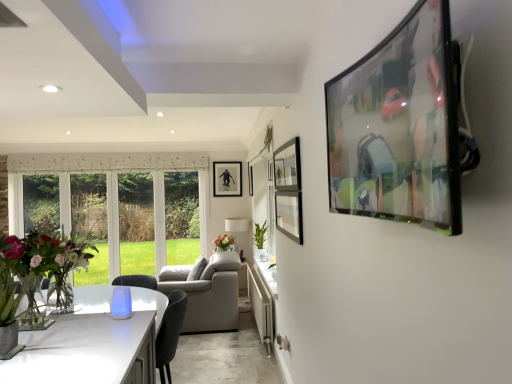
The image size is (512, 384). In order to click on matte black picture frame at center, the 2th picture frame positioned from the back in this screenshot , I will do `click(250, 179)`.

You are a GUI agent. You are given a task and a screenshot of the screen. Output one action in this format:
    pyautogui.click(x=<x>, y=<y>)
    Task: Click on the metallic silver picture frame at center, the 1th picture frame when ordered from back to front
    This screenshot has height=384, width=512.
    Given the screenshot: What is the action you would take?
    pos(227,179)

This screenshot has height=384, width=512. What are the coordinates of `white fabric lampshade at center` in the screenshot? It's located at (237, 224).

The height and width of the screenshot is (384, 512). I want to click on translucent glass vase at center, so click(x=224, y=241).

At what (x,y) coordinates should I click in order to perform the action: click on matte black picture frame at center, arranged as the second picture frame when viewed from the right. Please return your answer as a coordinate pair (x, y). This screenshot has width=512, height=384. Looking at the image, I should click on (250, 179).

Does point (248, 281) come farther from viewer compared to point (223, 239)?

No.

Is white glossy counter top at lower center aimed at translucent glass vase at center?

No, white glossy counter top at lower center is not facing towards translucent glass vase at center.

Where is `flower behind the white glossy counter top at lower center`? flower behind the white glossy counter top at lower center is located at coordinates (224, 241).

Considering the positions of objects white glossy counter top at lower center and translucent glass vase at center in the image provided, who is behind, white glossy counter top at lower center or translucent glass vase at center?

translucent glass vase at center is behind.

Does metallic silver picture frame at center, placed as the 3th picture frame when sorted from front to back, have a greater width compared to matte black picture frame at center, the 2th picture frame positioned from the back?

In fact, metallic silver picture frame at center, placed as the 3th picture frame when sorted from front to back, might be narrower than matte black picture frame at center, the 2th picture frame positioned from the back.

Is matte black picture frame at center, the 2th picture frame positioned from the back, at the back of metallic silver picture frame at center, arranged as the 1th picture frame when viewed from the left?

No.

Which of these two, metallic silver picture frame at center, acting as the third picture frame starting from the right, or matte black picture frame at center, the second picture frame when ordered from left to right, stands shorter?

matte black picture frame at center, the second picture frame when ordered from left to right, is shorter.

Is metallic silver picture frame at center, arranged as the 1th picture frame when viewed from the left, closer to camera compared to matte black picture frame at center, the 2th picture frame positioned from the back?

No, it is not.

The image size is (512, 384). In order to click on plant above the translucent glass vase at center (from the image's perspective) in this screenshot , I will do `click(260, 234)`.

Based on the photo, how different are the orientations of green glossy plant at center and translucent glass vase at center in degrees?

0.000805 degrees.

Which of these two, green glossy plant at center or translucent glass vase at center, is bigger?

Bigger between the two is green glossy plant at center.

Is green glossy plant at center shorter than translucent glass vase at center?

No.

Is white glossy counter top at lower center to the right of green glossy plant at center from the viewer's perspective?

No, white glossy counter top at lower center is not to the right of green glossy plant at center.

Looking at this image, is white glossy counter top at lower center turned away from green glossy plant at center?

No, green glossy plant at center is not at the back of white glossy counter top at lower center.

Identify the location of plant above the white glossy counter top at lower center (from a real-world perspective). (260, 234).

Consider the image. From the image's perspective, does white glossy counter top at lower center appear lower than green glossy plant at center?

Yes.

Is matte glass vase at left a part of green glossy plant at center?

No, matte glass vase at left is not inside green glossy plant at center.

Which is nearer, (255,228) or (54,240)?

Point (255,228) is positioned farther from the camera compared to point (54,240).

Measure the distance from green glossy plant at center to matte glass vase at left.

green glossy plant at center is 7.94 feet from matte glass vase at left.

Which is more to the left, green glossy plant at center or matte glass vase at left?

matte glass vase at left.

In the image, is green glossy plant at center on the left side or the right side of white glossy counter top at lower center?

In the image, green glossy plant at center appears on the right side of white glossy counter top at lower center.

This screenshot has height=384, width=512. Find the location of `plant above the white glossy counter top at lower center (from a real-world perspective)`. plant above the white glossy counter top at lower center (from a real-world perspective) is located at coordinates (260, 234).

From the image's perspective, is green glossy plant at center beneath white glossy counter top at lower center?

No, from the image's perspective, green glossy plant at center is not beneath white glossy counter top at lower center.

Considering the relative sizes of green glossy plant at center and white glossy counter top at lower center in the image provided, is green glossy plant at center bigger than white glossy counter top at lower center?

Actually, green glossy plant at center might be smaller than white glossy counter top at lower center.

Consider the image. Is matte glass vase at left to the left of matte black picture frame at center, arranged as the second picture frame when viewed from the right, from the viewer's perspective?

Correct, you'll find matte glass vase at left to the left of matte black picture frame at center, arranged as the second picture frame when viewed from the right.

Is matte glass vase at left not within matte black picture frame at center, the 2th picture frame positioned from the back?

Yes, matte glass vase at left is located beyond the bounds of matte black picture frame at center, the 2th picture frame positioned from the back.

The width and height of the screenshot is (512, 384). Find the location of `flower that is above the white glossy counter top at lower center (from the image's perspective)`. flower that is above the white glossy counter top at lower center (from the image's perspective) is located at coordinates (224, 241).

This screenshot has width=512, height=384. I want to click on the 1st picture frame in front of the metallic silver picture frame at center, acting as the third picture frame starting from the right, so click(250, 179).

Based on their spatial positions, is green glossy plant at center or matte glass vase at left closer to translucent glass vase at center?

green glossy plant at center.

When comparing their distances from translucent glass vase at center, does white glossy counter top at lower center or matte black tv at upper right, marked as the third picture frame in a back-to-front arrangement, seem closer?

Among the two, white glossy counter top at lower center is located nearer to translucent glass vase at center.

Based on the photo, which object lies further to the anchor point matte glass vase at left, metallic silver picture frame at center, arranged as the 1th picture frame when viewed from the left, or matte black tv at upper right, arranged as the first picture frame when viewed from the right?

metallic silver picture frame at center, arranged as the 1th picture frame when viewed from the left, is positioned further to the anchor matte glass vase at left.

From the image, which object appears to be farther from white fabric lampshade at center, green glossy plant at center or white glossy counter top at lower center?

white glossy counter top at lower center lies further to white fabric lampshade at center than the other object.

Considering their positions, is matte black picture frame at center, the second picture frame in the front-to-back sequence, positioned closer to translucent glass vase at center than white fabric lampshade at center?

white fabric lampshade at center lies closer to translucent glass vase at center than the other object.

From the picture: From the image, which object appears to be nearer to matte black tv at upper right, the 1th picture frame viewed from the front, translucent glass vase at center or matte black picture frame at center, the second picture frame when ordered from left to right?

The object closer to matte black tv at upper right, the 1th picture frame viewed from the front, is matte black picture frame at center, the second picture frame when ordered from left to right.

Estimate the real-world distances between objects in this image. Which object is closer to translucent glass vase at center, matte black picture frame at center, the 2th picture frame positioned from the back, or green glossy plant at center?

green glossy plant at center is closer to translucent glass vase at center.

Estimate the real-world distances between objects in this image. Which object is closer to matte black picture frame at center, the 2th picture frame positioned from the back, matte black tv at upper right, arranged as the first picture frame when viewed from the right, or white glossy counter top at lower center?

The object closer to matte black picture frame at center, the 2th picture frame positioned from the back, is white glossy counter top at lower center.

Where is `counter top between matte black tv at upper right, the 3th picture frame from the left, and metallic silver picture frame at center, placed as the 3th picture frame when sorted from front to back, from front to back`? Image resolution: width=512 pixels, height=384 pixels. counter top between matte black tv at upper right, the 3th picture frame from the left, and metallic silver picture frame at center, placed as the 3th picture frame when sorted from front to back, from front to back is located at coordinates (261, 306).

What are the coordinates of `counter top between matte black tv at upper right, the 1th picture frame viewed from the front, and green glossy plant at center in the front-back direction` in the screenshot? It's located at (261, 306).

Locate an element on the screen. Image resolution: width=512 pixels, height=384 pixels. flower between white glossy counter top at lower center and metallic silver picture frame at center, the 1th picture frame when ordered from back to front, along the z-axis is located at coordinates pos(224,241).

I want to click on picture frame positioned between white glossy counter top at lower center and white fabric lampshade at center from near to far, so click(x=250, y=179).